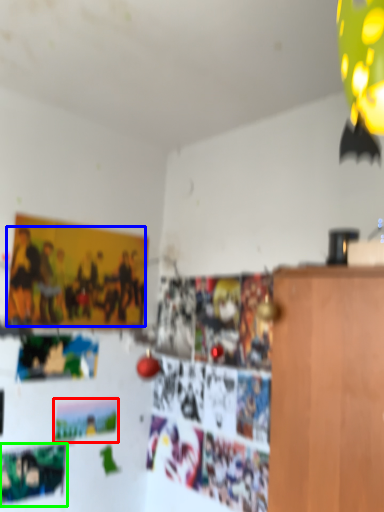
Question: Which is farther away from postcard (highlighted by a red box)? person (highlighted by a blue box) or poster (highlighted by a green box)?

Choices:
 (A) person
 (B) poster

Answer: (A)